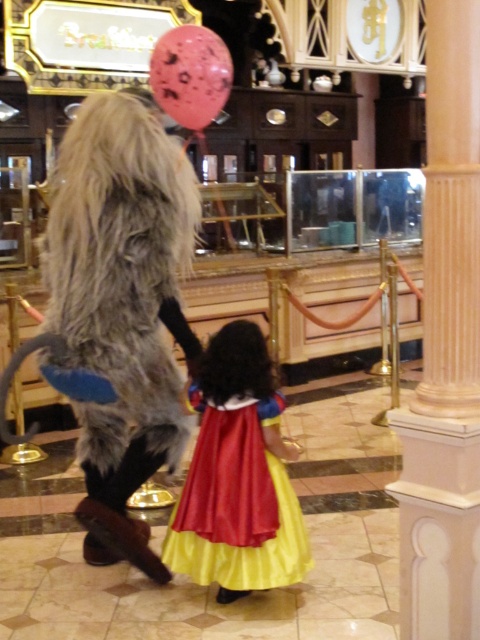
Is white marble column at center taller than pink dotted balloon at upper center?

Indeed, white marble column at center has a greater height compared to pink dotted balloon at upper center.

Between white marble column at center and pink dotted balloon at upper center, which one has more height?

With more height is white marble column at center.

Measure the distance between point (450, 176) and camera.

7.99 feet

This screenshot has width=480, height=640. I want to click on white marble column at center, so click(x=445, y=349).

Can you confirm if shiny satin dress at center is positioned to the left of pink dotted balloon at upper center?

No, shiny satin dress at center is not to the left of pink dotted balloon at upper center.

Can you confirm if shiny satin dress at center is positioned above pink dotted balloon at upper center?

Incorrect, shiny satin dress at center is not positioned above pink dotted balloon at upper center.

This screenshot has width=480, height=640. Identify the location of shiny satin dress at center. (238, 477).

Does white marble column at center have a larger size compared to shiny satin dress at center?

Incorrect, white marble column at center is not larger than shiny satin dress at center.

From the picture: Which of these two, white marble column at center or shiny satin dress at center, stands shorter?

Standing shorter between the two is shiny satin dress at center.

Is point (463, 90) farther from camera compared to point (237, 544)?

No, it is in front of (237, 544).

Identify the location of white marble column at center. The width and height of the screenshot is (480, 640). (445, 349).